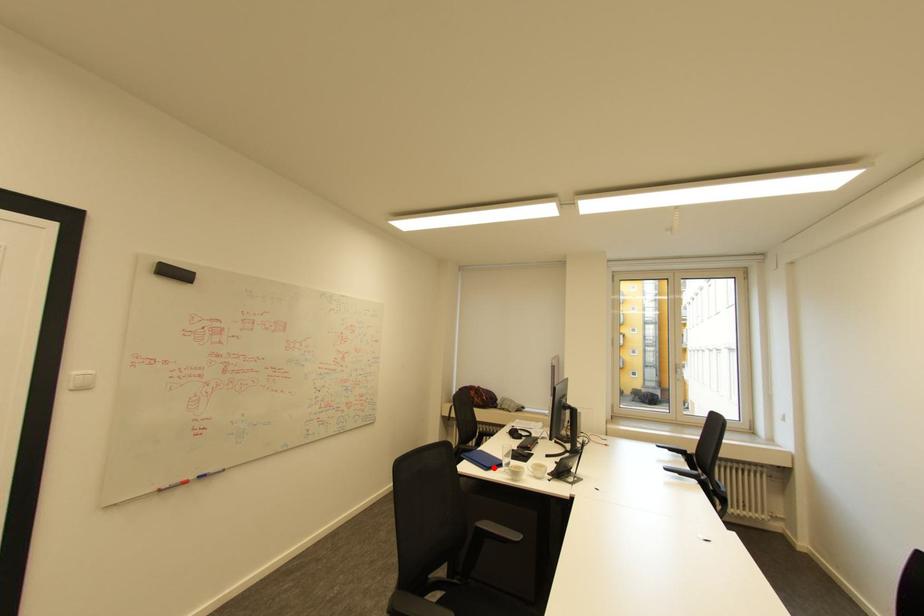
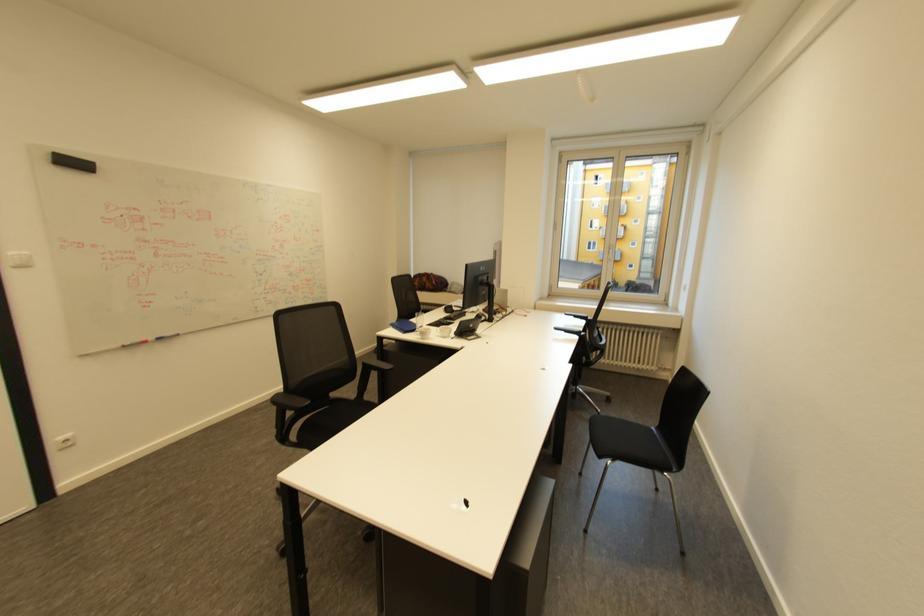
The point at the highlighted location is marked in the first image. Where is the corresponding point in the second image?

(411, 331)